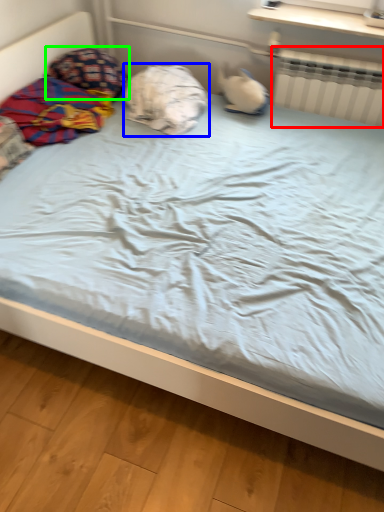
Question: Based on their relative distances, which object is farther from radiator (highlighted by a red box)? Choose from pillow (highlighted by a blue box) and pillow (highlighted by a green box).

Choices:
 (A) pillow
 (B) pillow

Answer: (B)